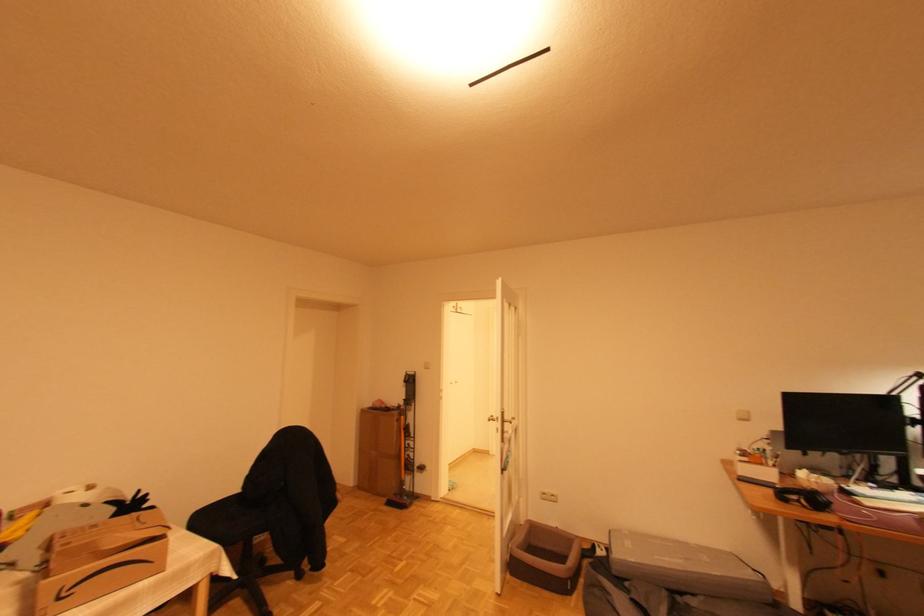
Which object does [803,496] point to?

This point indicates the black headphones.